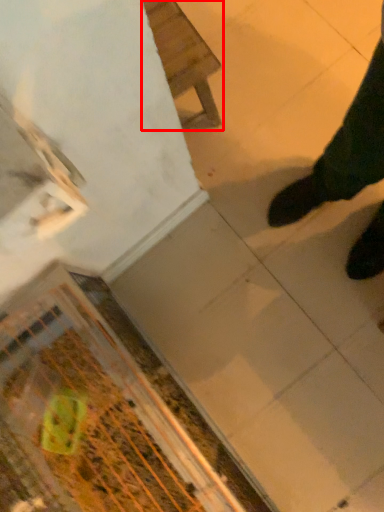
Question: From the image's perspective, where is furniture (annotated by the red box) located in relation to debris in the image?

Choices:
 (A) above
 (B) below

Answer: (A)